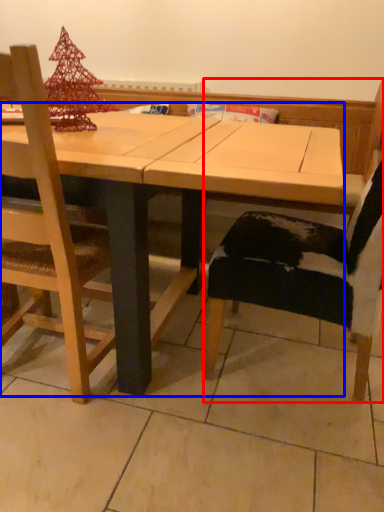
Question: Which point is further to the camera, chair (highlighted by a red box) or table (highlighted by a blue box)?

Choices:
 (A) chair
 (B) table

Answer: (B)